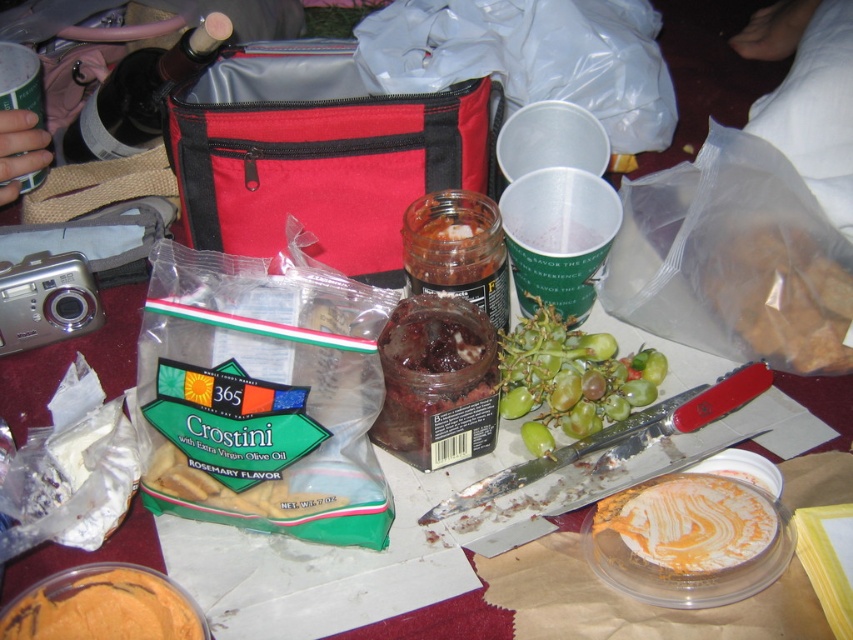
Between point (480, 236) and point (283, 493), which one is positioned in front?

Point (283, 493)

Who is more distant from viewer, (473, 218) or (198, 480)?

The point (473, 218) is more distant.

This screenshot has height=640, width=853. What are the coordinates of `shiny glass jar at center` in the screenshot? It's located at (451, 241).

Which is in front, point (689, 509) or point (300, 512)?

Point (300, 512) is in front.

Can you confirm if smooth orange spread at center is thinner than golden crostini at center?

Indeed, smooth orange spread at center has a lesser width compared to golden crostini at center.

Between point (680, 524) and point (169, 456), which one is positioned behind?

Positioned behind is point (680, 524).

Image resolution: width=853 pixels, height=640 pixels. I want to click on smooth orange spread at center, so click(x=689, y=522).

Who is lower down, green matte grapes at center or orange creamy spread at center?

Positioned lower is orange creamy spread at center.

How far apart are green matte grapes at center and orange creamy spread at center?

18.12 inches

Does point (605, 346) come closer to viewer compared to point (100, 636)?

That is False.

Find the location of a particular element. The image size is (853, 640). green matte grapes at center is located at coordinates (570, 378).